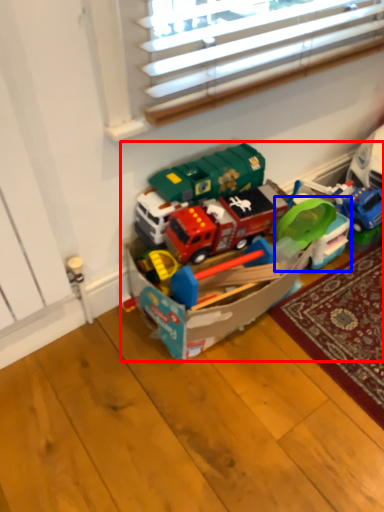
Question: Among these objects, which one is farthest to the camera, toy (highlighted by a red box) or toy (highlighted by a blue box)?

Choices:
 (A) toy
 (B) toy

Answer: (B)